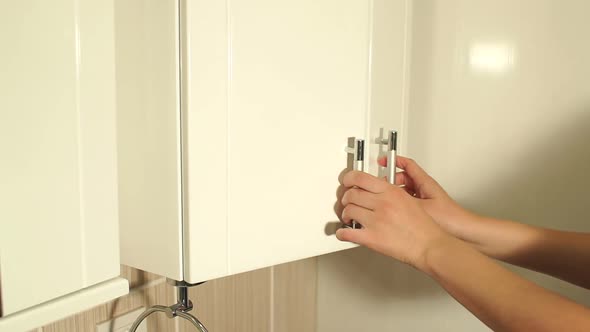
Locate an element on the screen. This screenshot has width=590, height=332. shelve handle is located at coordinates (355, 156), (389, 153).